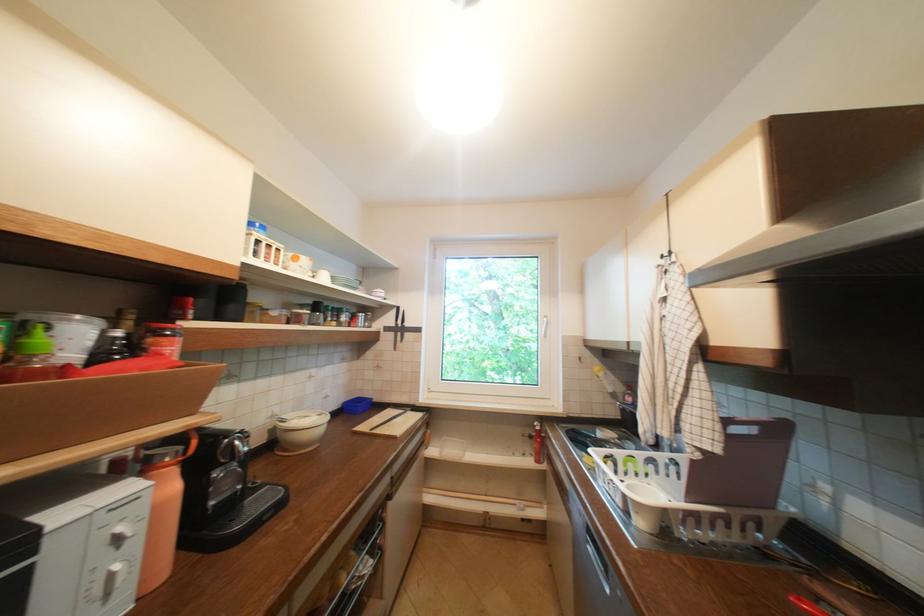
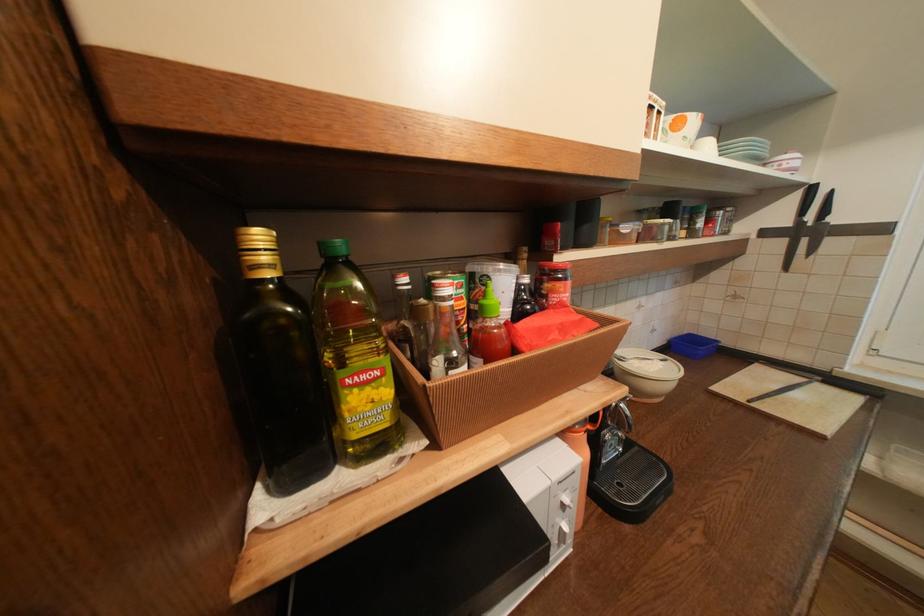
Where in the second image is the point corresponding to (x=300, y=254) from the first image?

(683, 118)